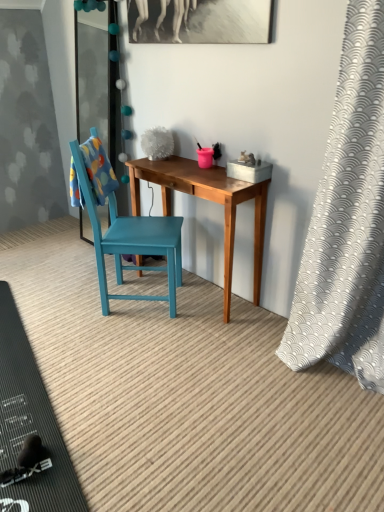
This screenshot has width=384, height=512. I want to click on vacant area that lies between wooden desk at center and teal wooden chair at center, so [186, 318].